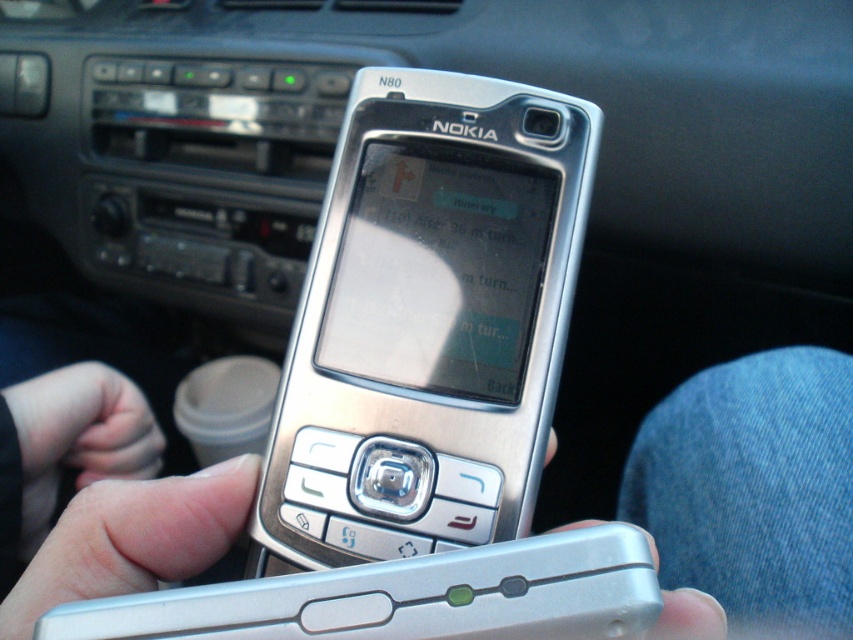
You are a passenger in the car and want to check the navigation on the silver metallic nokia phone at center and the silver metallic phone at center. Which one can you see more clearly?

The silver metallic nokia phone at center is closer to the viewer than the silver metallic phone at center, so it can be seen more clearly.

You are a passenger in a car and want to check the navigation on your silver metallic nokia phone at center. However, there is another silver metallic phone at center in the car. How far apart are the two phones?

The distance between the silver metallic nokia phone at center and the silver metallic phone at center is 45.20 centimeters.